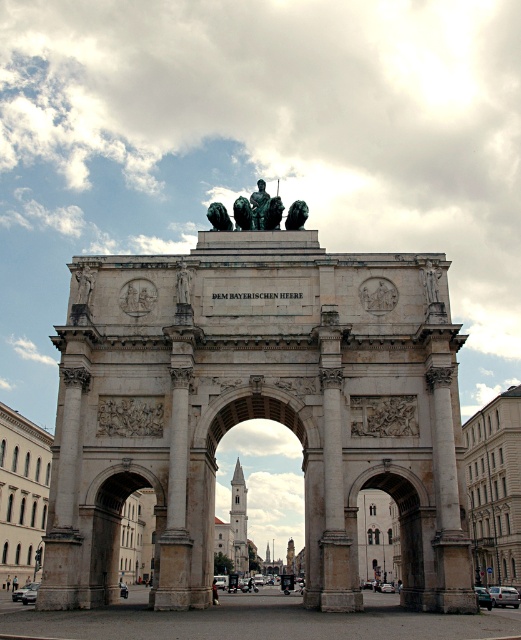
Based on the description of the Siegestor in Munich, which bronze statue is taller when comparing the bronze statue at upper left and the bronze statue at center?

The bronze statue at center is taller than the bronze statue at upper left.

You are an art student analyzing the Siegestor in Munich. You observe the green patina statue at center and the bronze statue at upper right. Based on their positions and sizes, which statue would likely cast a longer shadow during midday when the sun is directly overhead?

The green patina statue at center is wider than the bronze statue at upper right, so it would cast a longer shadow during midday when the sun is directly overhead because wider objects typically cast longer shadows when the light source is overhead.

You are standing in front of the Siegestor in Munich. You want to take a photo of the polished stone arch at center. Where should you position your camera to capture the entire structure in the frame?

The polished stone arch at center is located at coordinates point (257, 412), so position your camera directly in front of it to ensure the entire structure is centered and within the frame.